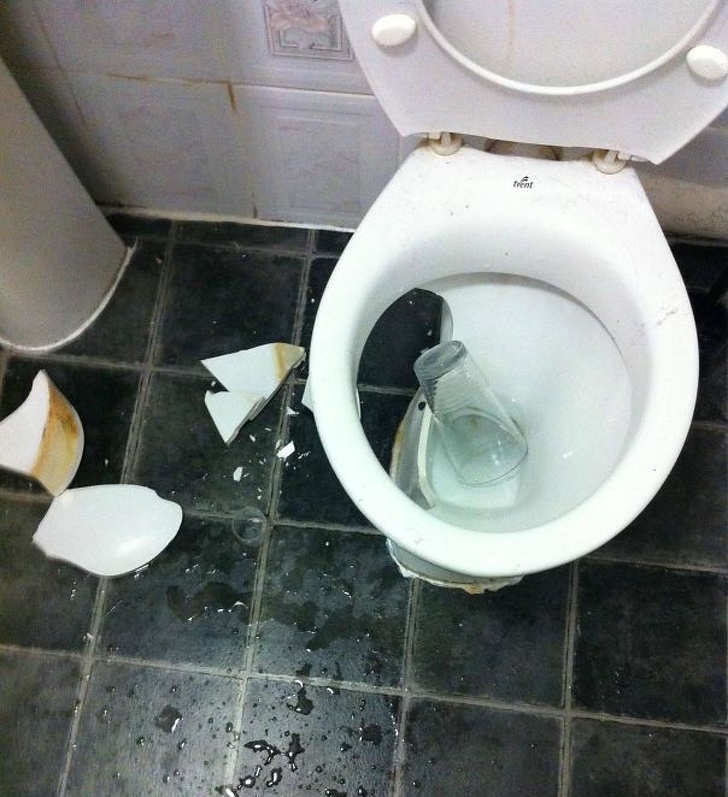
You are a GUI agent. You are given a task and a screenshot of the screen. Output one action in this format:
    pyautogui.click(x=<x>, y=<y>)
    Task: Click on the toilet lid
    The width and height of the screenshot is (728, 797).
    Given the screenshot: What is the action you would take?
    pyautogui.click(x=552, y=32)